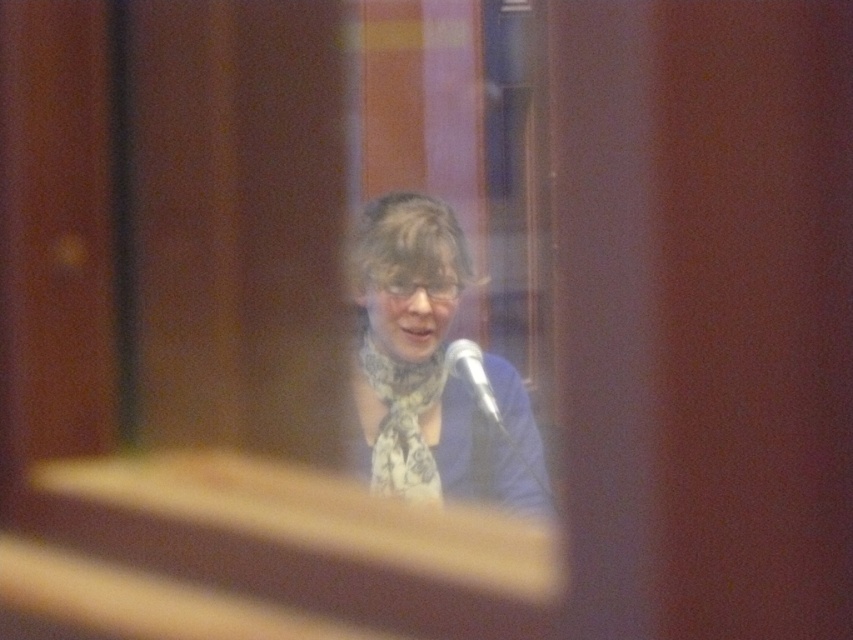
You are standing in the room and want to place a small decorative item exactly at the same position as the white printed scarf at center. What coordinates should you aim for?

The coordinates for the white printed scarf at center are at point (433,369).

You are a photographer standing 5 feet away from the glass pane. You want to take a clear photo of the white printed scarf at center. Can you focus on it without moving closer?

The white printed scarf at center is 4.41 feet away from the viewer. Since you are standing 5 feet away from the glass pane, the scarf is beyond your current position. To focus clearly, you need to move closer to reduce the distance between yourself and the scarf.

You are an event organizer setting up a stage for a presentation. You need to ensure that the white printed scarf at center and the silver metallic microphone at center are visible to the audience. Given their positions and sizes, which object might block the view of the other when viewed from the back of the room?

The white printed scarf at center is much taller than the silver metallic microphone at center, so it might block the view of the microphone from the back of the room.